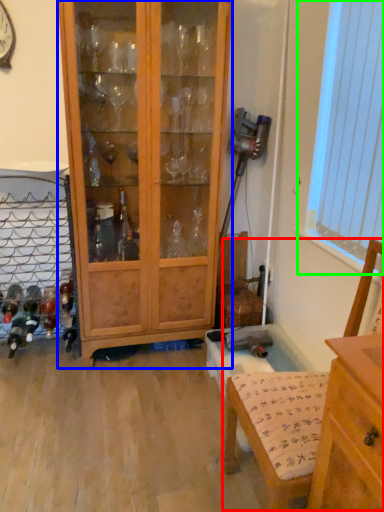
Question: Which object is the closest to the armchair (highlighted by a red box)? Choose among these: cabinetry (highlighted by a blue box) or window screen (highlighted by a green box).

Choices:
 (A) cabinetry
 (B) window screen

Answer: (B)